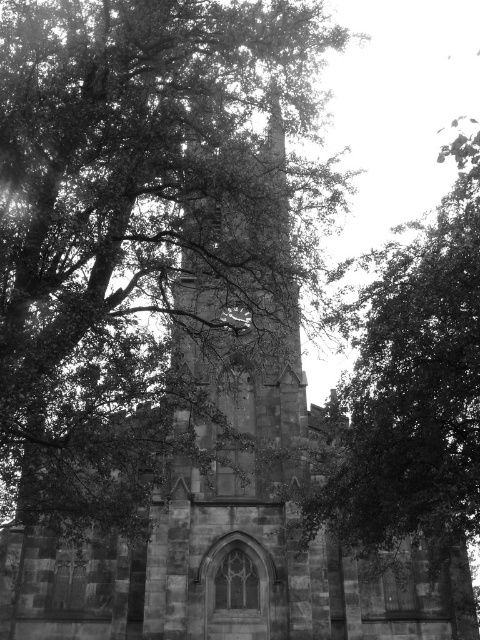
You are a photographer standing at the edge of the scene. You want to capture the Gothic church tower without any obstruction from the dark green leafy tree at center. Based on the coordinates provided, can you position yourself to the left or right of the tree to achieve an unobstructed view?

The dark green leafy tree at center is located at coordinates 0.602 on the x and 0.860 on the y axis. To avoid obstruction, position yourself to the left side of the tree since the tree is centered, and moving left would place you outside its obstructive area.

From the picture: You are standing in front of a Gothic church tower surrounded by trees. There is a point marked at coordinates point (412,385). What object does this point correspond to?

The point (412,385) corresponds to the dark green leafy tree at center.